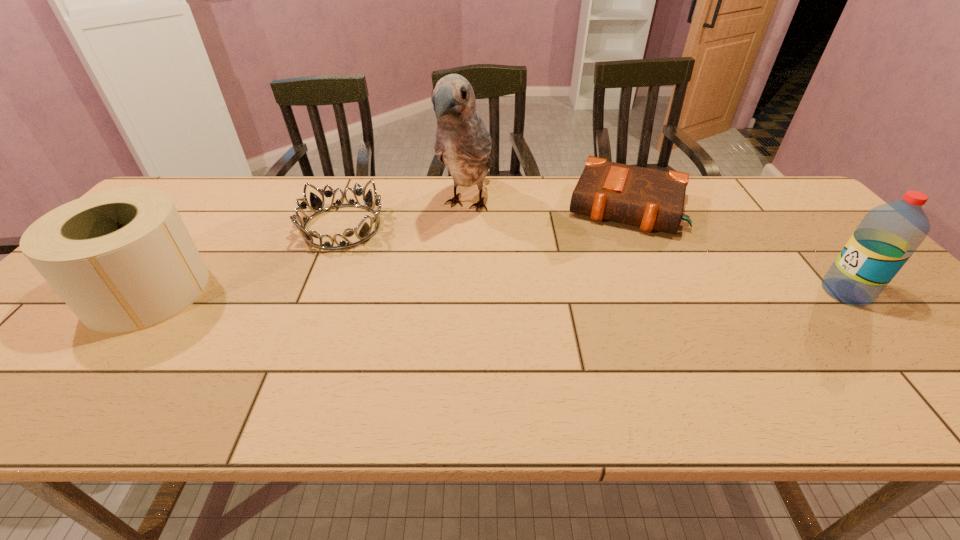
This screenshot has width=960, height=540. What are the coordinates of `free point located on the spine side of the Bible` in the screenshot? It's located at (612, 251).

This screenshot has height=540, width=960. What are the coordinates of `parrot that is at the far edge` in the screenshot? It's located at (463, 143).

At what (x,y) coordinates should I click in order to perform the action: click on tiara located in the far edge section of the desktop. Please return your answer as a coordinate pair (x, y). This screenshot has height=540, width=960. Looking at the image, I should click on click(x=316, y=203).

I want to click on Bible that is at the far edge, so click(x=651, y=199).

Where is `object that is at the left edge`? object that is at the left edge is located at coordinates (122, 260).

Find the location of a particular element. The width and height of the screenshot is (960, 540). object present at the right edge is located at coordinates pyautogui.click(x=889, y=234).

You are a GUI agent. You are given a task and a screenshot of the screen. Output one action in this format:
    pyautogui.click(x=<x>, y=<y>)
    Task: Click on the vacant area at the far edge of the desktop
    
    Given the screenshot: What is the action you would take?
    pyautogui.click(x=698, y=192)

Identify the location of free region at the near edge. Image resolution: width=960 pixels, height=540 pixels. (564, 354).

You are a GUI agent. You are given a task and a screenshot of the screen. Output one action in this format:
    pyautogui.click(x=<x>, y=<y>)
    Task: Click on the free space at the right edge of the desktop
    
    Given the screenshot: What is the action you would take?
    pyautogui.click(x=793, y=234)

At what (x,y) coordinates should I click in order to perform the action: click on vacant area at the near right corner. Please return your answer as a coordinate pair (x, y). The width and height of the screenshot is (960, 540). Looking at the image, I should click on tap(925, 363).